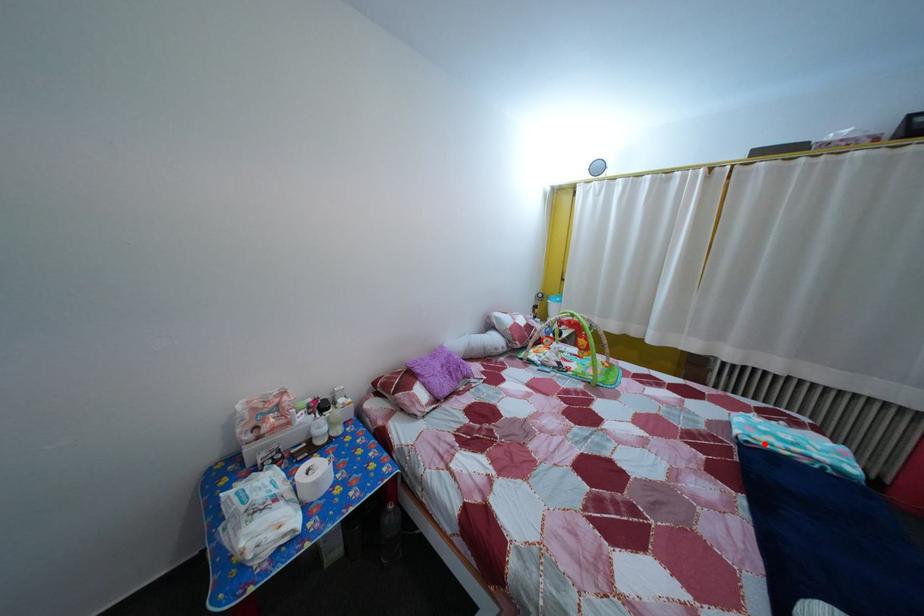
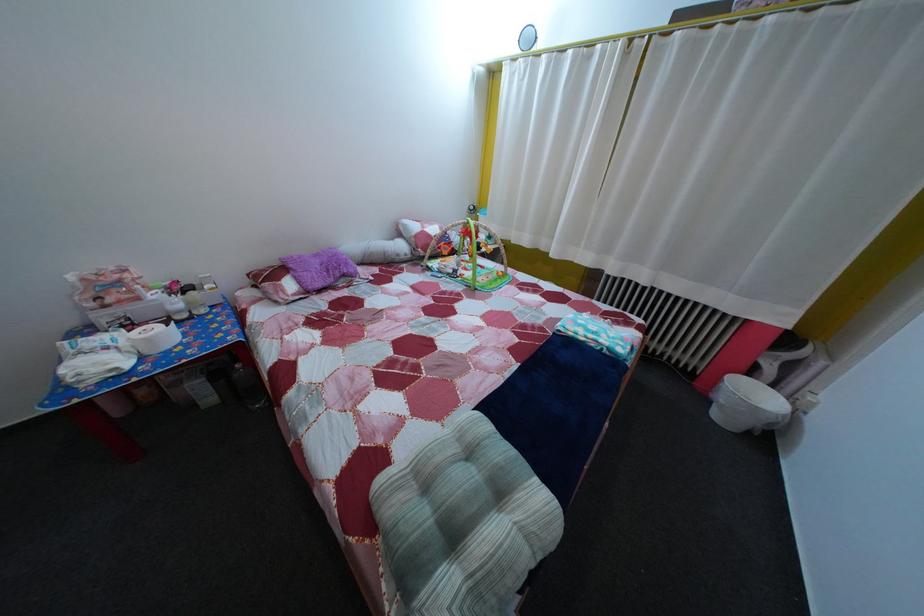
Locate, in the second image, the point that corresponds to the highlighted location in the first image.

(578, 334)